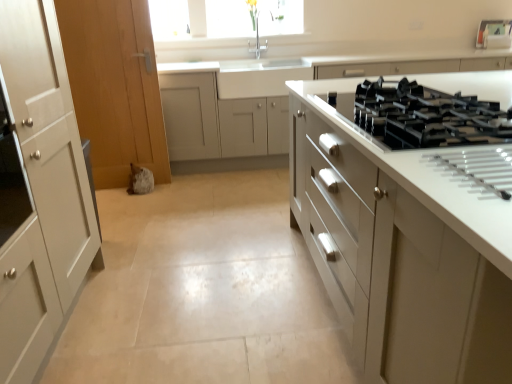
Question: Is black glass gas stove at right completely or partially outside of white glossy cabinet at right, the first cabinetry viewed from the front?

Choices:
 (A) yes
 (B) no

Answer: (B)

Question: From the image's perspective, is black glass gas stove at right over white glossy cabinet at right, the first cabinetry viewed from the front?

Choices:
 (A) yes
 (B) no

Answer: (A)

Question: Considering the relative sizes of black glass gas stove at right and white glossy cabinet at right, the first cabinetry viewed from the front, in the image provided, is black glass gas stove at right wider than white glossy cabinet at right, the first cabinetry viewed from the front,?

Choices:
 (A) no
 (B) yes

Answer: (A)

Question: Considering the relative sizes of black glass gas stove at right and white glossy cabinet at right, the first cabinetry viewed from the front, in the image provided, is black glass gas stove at right thinner than white glossy cabinet at right, the first cabinetry viewed from the front,?

Choices:
 (A) no
 (B) yes

Answer: (B)

Question: Does black glass gas stove at right appear on the right side of white glossy cabinet at right, the second cabinetry viewed from the back?

Choices:
 (A) yes
 (B) no

Answer: (B)

Question: In terms of height, does white glossy cabinetry at center, which is the second cabinetry in front-to-back order, look taller or shorter compared to white glossy cabinet at right, the second cabinetry viewed from the back?

Choices:
 (A) tall
 (B) short

Answer: (A)

Question: From the image's perspective, is white glossy cabinetry at center, which is the second cabinetry in front-to-back order, above or below white glossy cabinet at right, the second cabinetry viewed from the back?

Choices:
 (A) below
 (B) above

Answer: (B)

Question: From a real-world perspective, relative to white glossy cabinet at right, the second cabinetry viewed from the back, is white glossy cabinetry at center, the first cabinetry in the back-to-front sequence, vertically above or below?

Choices:
 (A) below
 (B) above

Answer: (B)

Question: Looking at the image, does white glossy cabinetry at center, which is the second cabinetry in front-to-back order, seem bigger or smaller compared to white glossy cabinet at right, the first cabinetry viewed from the front?

Choices:
 (A) small
 (B) big

Answer: (A)

Question: Based on their positions, is white glossy cabinetry at center, which is the second cabinetry in front-to-back order, located to the left or right of black glass gas stove at right?

Choices:
 (A) right
 (B) left

Answer: (A)

Question: Does point (275, 120) appear closer or farther from the camera than point (424, 134)?

Choices:
 (A) closer
 (B) farther

Answer: (B)

Question: Considering the positions of white glossy cabinetry at center, the first cabinetry in the back-to-front sequence, and black glass gas stove at right in the image, is white glossy cabinetry at center, the first cabinetry in the back-to-front sequence, bigger or smaller than black glass gas stove at right?

Choices:
 (A) small
 (B) big

Answer: (B)

Question: Would you say white glossy cabinetry at center, the first cabinetry in the back-to-front sequence, is inside or outside black glass gas stove at right?

Choices:
 (A) outside
 (B) inside

Answer: (A)

Question: Does point (337, 165) appear closer or farther from the camera than point (480, 110)?

Choices:
 (A) farther
 (B) closer

Answer: (A)

Question: Considering their positions, is white glossy cabinet at right, the first cabinetry viewed from the front, located in front of or behind black glass gas stove at right?

Choices:
 (A) behind
 (B) front

Answer: (B)